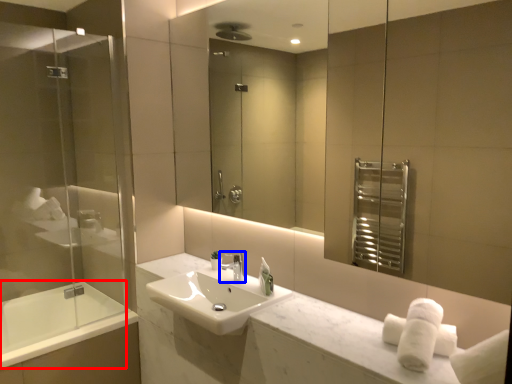
Question: Which object appears closest to the camera in this image, bath (highlighted by a red box) or tap (highlighted by a blue box)?

Choices:
 (A) bath
 (B) tap

Answer: (B)